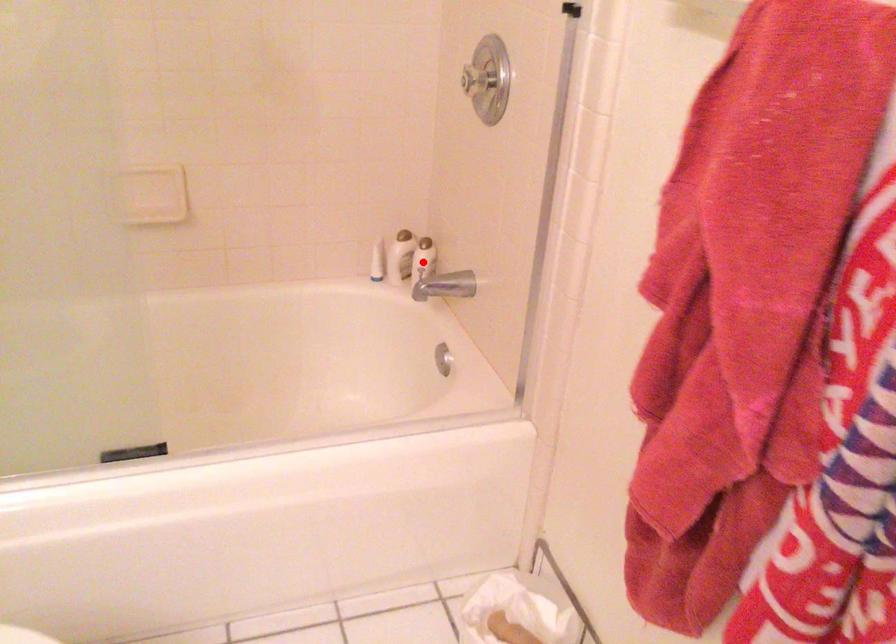
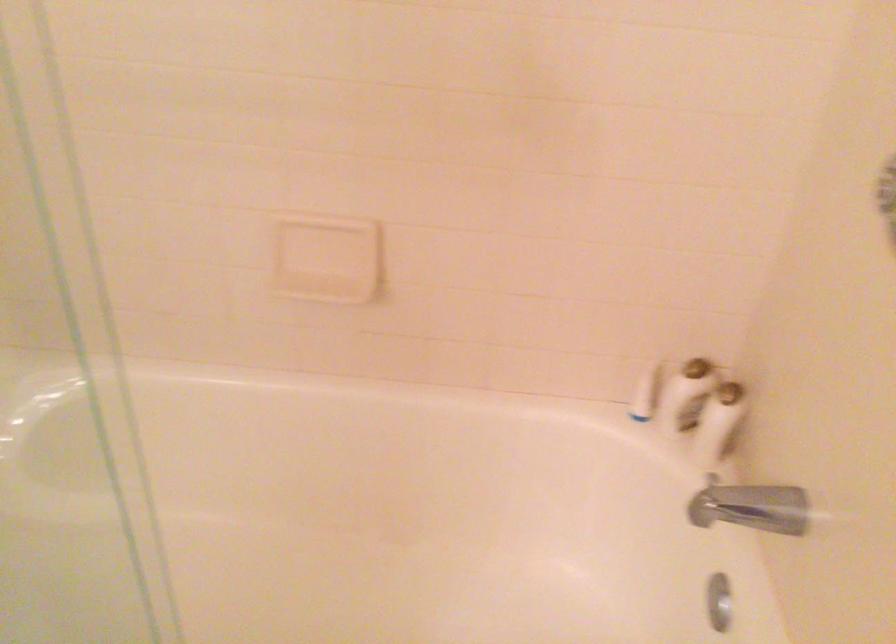
In the second image, find the point that corresponds to the highlighted location in the first image.

(718, 422)